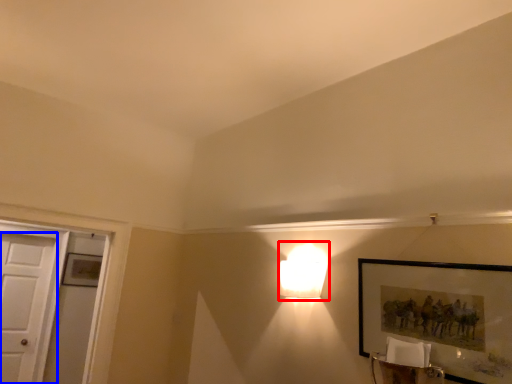
Question: Which point is closer to the camera, lamp (highlighted by a red box) or door (highlighted by a blue box)?

Choices:
 (A) lamp
 (B) door

Answer: (A)